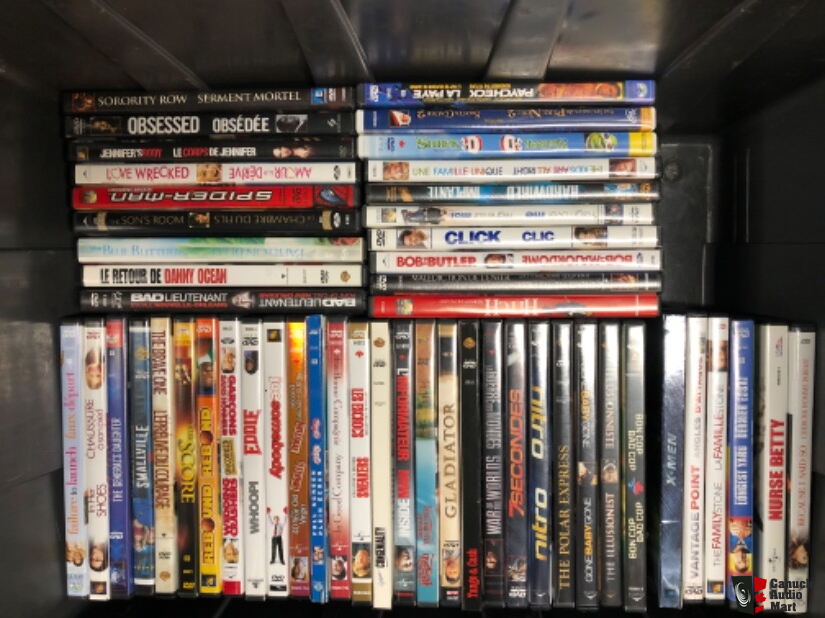
Where is `books stacked horizontally on left side`? This screenshot has width=825, height=618. books stacked horizontally on left side is located at coordinates (290, 95), (286, 115), (283, 149), (283, 171), (281, 192), (281, 226), (283, 248), (299, 271), (294, 298).